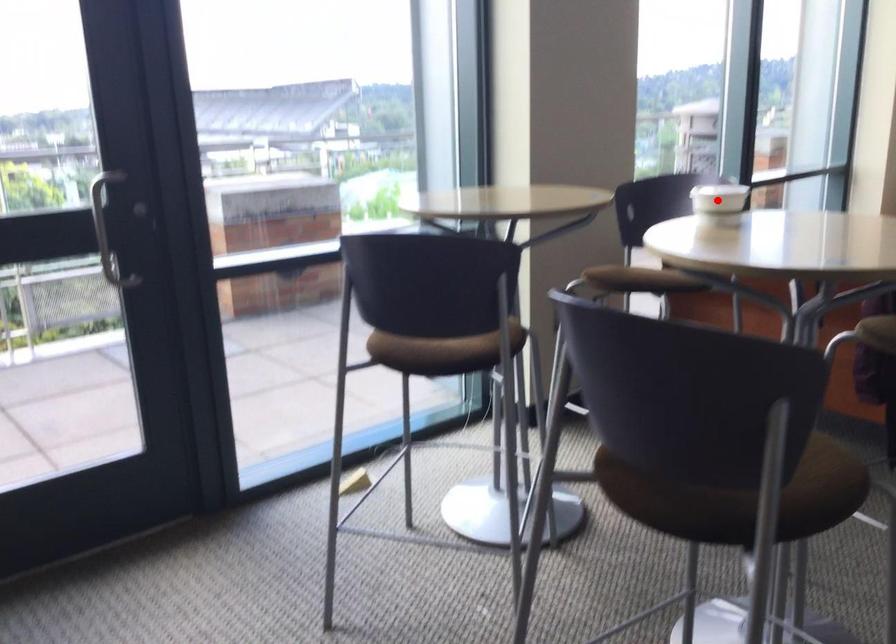
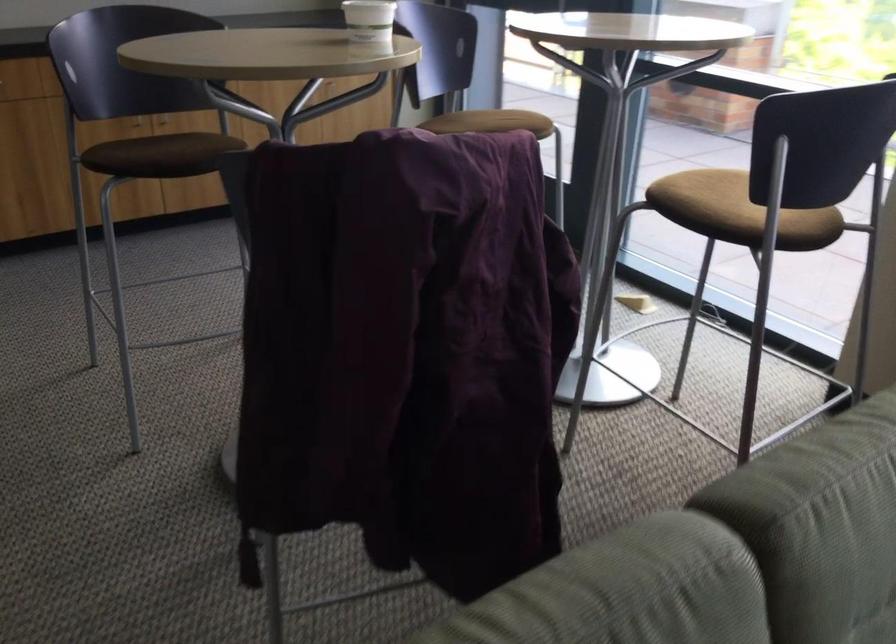
In the second image, find the point that corresponds to the highlighted location in the first image.

(368, 20)